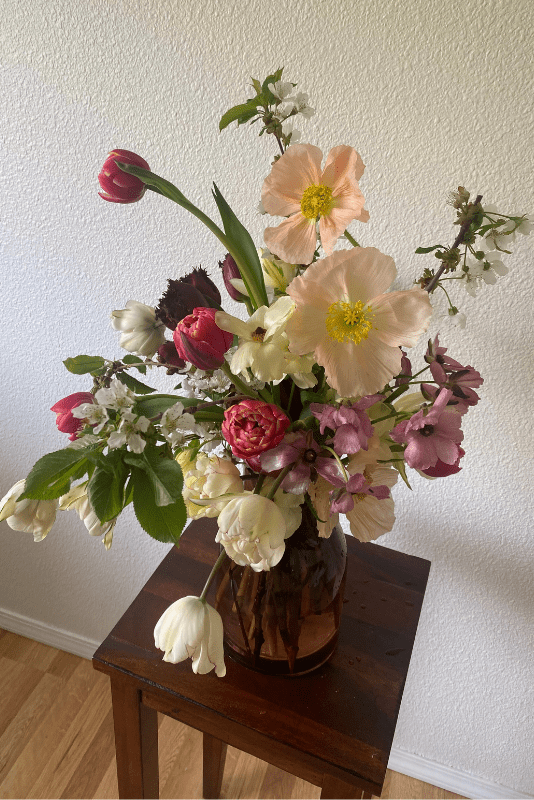
Find the location of a particular element. textured wall is located at coordinates (473, 672), (456, 530), (444, 138), (85, 105), (69, 306), (69, 586).